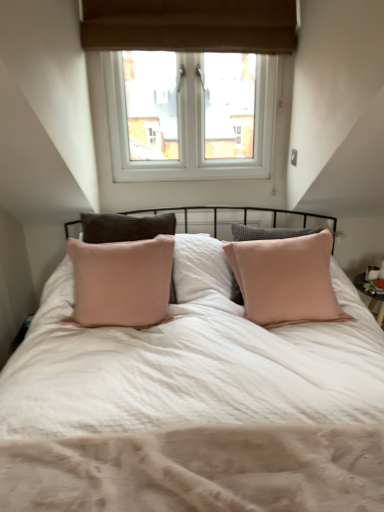
Question: Should I look upward or downward to see white plastic window at upper center?

Choices:
 (A) up
 (B) down

Answer: (A)

Question: From the image's perspective, is beige textured mattress at center on white plastic window at upper center?

Choices:
 (A) no
 (B) yes

Answer: (A)

Question: Is beige textured mattress at center oriented towards white plastic window at upper center?

Choices:
 (A) yes
 (B) no

Answer: (B)

Question: Is beige textured mattress at center further to the viewer compared to white plastic window at upper center?

Choices:
 (A) yes
 (B) no

Answer: (B)

Question: Is beige textured mattress at center facing away from white plastic window at upper center?

Choices:
 (A) no
 (B) yes

Answer: (A)

Question: Considering the relative sizes of beige textured mattress at center and white plastic window at upper center in the image provided, is beige textured mattress at center wider than white plastic window at upper center?

Choices:
 (A) yes
 (B) no

Answer: (A)

Question: Is beige textured mattress at center shorter than white plastic window at upper center?

Choices:
 (A) yes
 (B) no

Answer: (A)

Question: Does white plastic window at upper center lie behind beige textured mattress at center?

Choices:
 (A) no
 (B) yes

Answer: (B)

Question: Is white plastic window at upper center bigger than beige textured mattress at center?

Choices:
 (A) yes
 (B) no

Answer: (A)

Question: Can you confirm if white plastic window at upper center is smaller than beige textured mattress at center?

Choices:
 (A) no
 (B) yes

Answer: (A)

Question: From the image's perspective, is white plastic window at upper center beneath beige textured mattress at center?

Choices:
 (A) no
 (B) yes

Answer: (A)

Question: Is white plastic window at upper center at the left side of beige textured mattress at center?

Choices:
 (A) yes
 (B) no

Answer: (A)

Question: Would you say white plastic window at upper center contains beige textured mattress at center?

Choices:
 (A) no
 (B) yes

Answer: (A)

Question: Considering the positions of point (192, 440) and point (114, 16), is point (192, 440) closer or farther from the camera than point (114, 16)?

Choices:
 (A) closer
 (B) farther

Answer: (A)